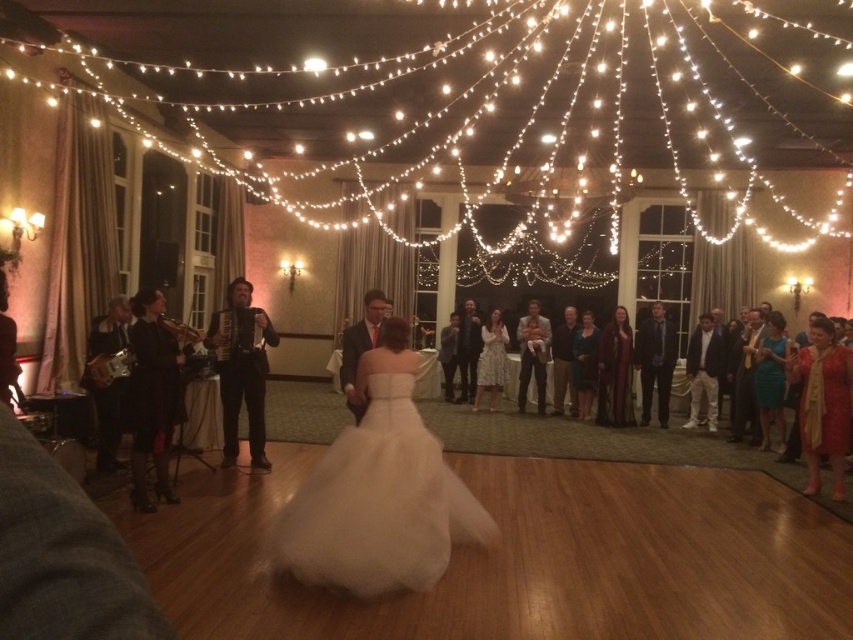
You are a photographer at the wedding reception. You want to position yourself so that you can capture both the bride in the foreground and the black leather accordion represented by point (155,394) in the same frame. Given that the camera has a 60 degree field of view, will you be able to frame both subjects without moving your position?

The black leather accordion represented by point (155,394) is positioned to the left of the bride in the foreground. Since the camera has a 60 degree field of view, it is possible to capture both subjects in the same frame by adjusting the angle slightly to include both the bride and the accordion without moving your position.

You are a photographer at the wedding reception. You want to take a photo of the white lace dress at center without the black leather accordion at left blocking it. Where should you position yourself relative to the current viewpoint?

To avoid the black leather accordion at left blocking the white lace dress at center, you should move to a position behind the black leather accordion at left, as it is currently in front of the white lace dress at center and moving behind it would place the accordion between you and the dress, allowing an unobstructed view of the dress.